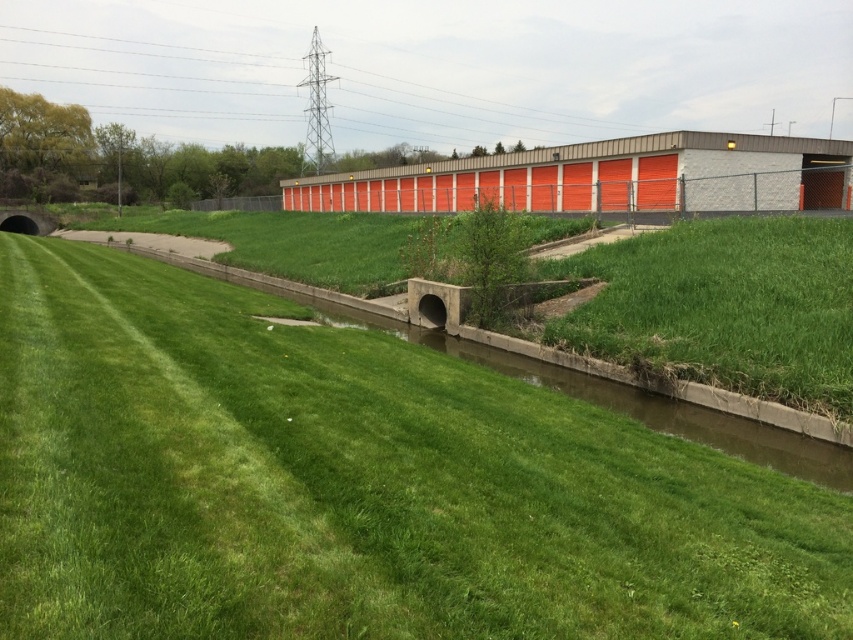
Consider the image. Who is shorter, green grass at center or green grassy at center?

green grass at center is shorter.

Is green grass at center closer to the viewer compared to green grassy at center?

That is True.

You are a GUI agent. You are given a task and a screenshot of the screen. Output one action in this format:
    pyautogui.click(x=<x>, y=<y>)
    Task: Click on the green grass at center
    
    Given the screenshot: What is the action you would take?
    pyautogui.click(x=355, y=484)